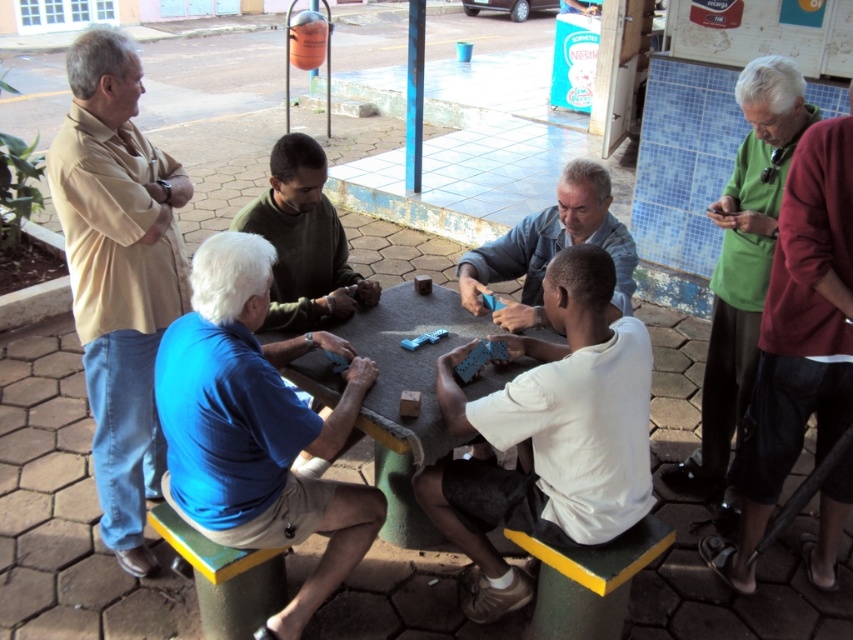
Measure the distance between point (180, 493) and camera.

Point (180, 493) and camera are 7.57 feet apart.

Where is `blue cotton shirt at lower left`? blue cotton shirt at lower left is located at coordinates (257, 428).

Where is `blue cotton shirt at lower left`? Image resolution: width=853 pixels, height=640 pixels. blue cotton shirt at lower left is located at coordinates (257, 428).

Between point (721, 385) and point (538, 321), which one is positioned in front?

Point (538, 321) is in front.

Is green matte shirt at upper right above light blue fabric shirt at center?

Actually, green matte shirt at upper right is below light blue fabric shirt at center.

I want to click on green matte shirt at upper right, so click(x=744, y=257).

Does beige cotton shirt at left appear on the left side of smooth gray table at center?

Yes, beige cotton shirt at left is to the left of smooth gray table at center.

Identify the location of beige cotton shirt at left. 119,275.

Image resolution: width=853 pixels, height=640 pixels. Identify the location of beige cotton shirt at left. [x=119, y=275].